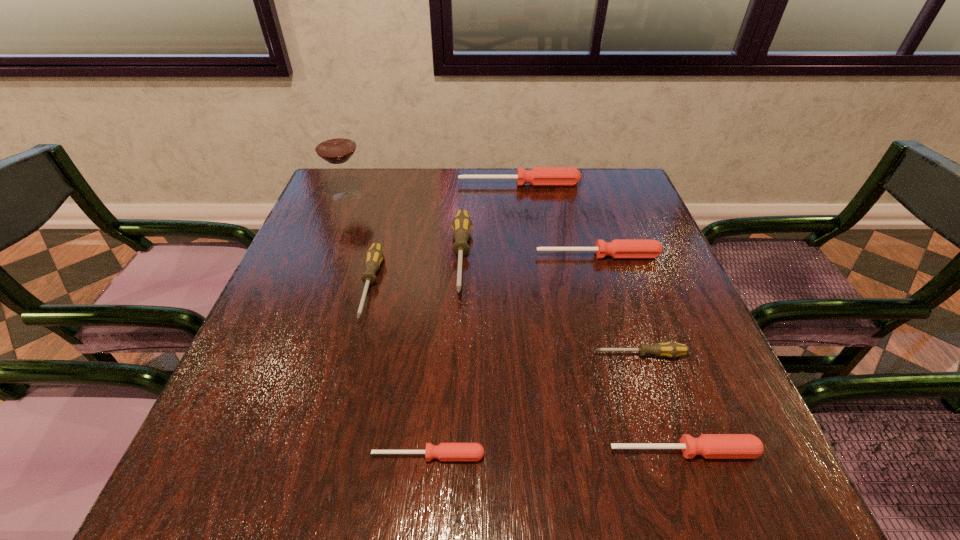
Locate an element on the screen. This screenshot has height=540, width=960. vacant point located between the shortest object and the second object from left to right is located at coordinates (399, 370).

This screenshot has height=540, width=960. I want to click on free space between the red wineglass and the second gray screwdriver from left to right, so click(404, 226).

Where is `vacant area between the second biggest red screwdriver and the rightmost gray screwdriver`? This screenshot has height=540, width=960. vacant area between the second biggest red screwdriver and the rightmost gray screwdriver is located at coordinates (619, 305).

Image resolution: width=960 pixels, height=540 pixels. I want to click on empty space between the leftmost screwdriver and the smallest gray screwdriver, so click(x=505, y=320).

Locate an element on the screen. vacant space in between the biggest red screwdriver and the second smallest gray screwdriver is located at coordinates (444, 235).

The height and width of the screenshot is (540, 960). What are the coordinates of `object that is the second closest one to the tallest object` in the screenshot? It's located at (538, 176).

Identify which object is the nearest to the farthest red screwdriver. Please provide its 2D coordinates. Your answer should be formatted as a tuple, i.e. [(x, y)], where the tuple contains the x and y coordinates of a point satisfying the conditions above.

[(461, 224)]

This screenshot has height=540, width=960. I want to click on screwdriver that is the third closest to the red wineglass, so click(461, 224).

You are a GUI agent. You are given a task and a screenshot of the screen. Output one action in this format:
    pyautogui.click(x=<x>, y=<y>)
    Task: Click on the screwdriver that can be found as the third closest to the biggest red screwdriver
    Image resolution: width=960 pixels, height=540 pixels.
    Given the screenshot: What is the action you would take?
    pyautogui.click(x=374, y=256)

Identify which gray screwdriver is located as the nearest to the shortest screwdriver. Please provide its 2D coordinates. Your answer should be formatted as a tuple, i.e. [(x, y)], where the tuple contains the x and y coordinates of a point satisfying the conditions above.

[(374, 256)]